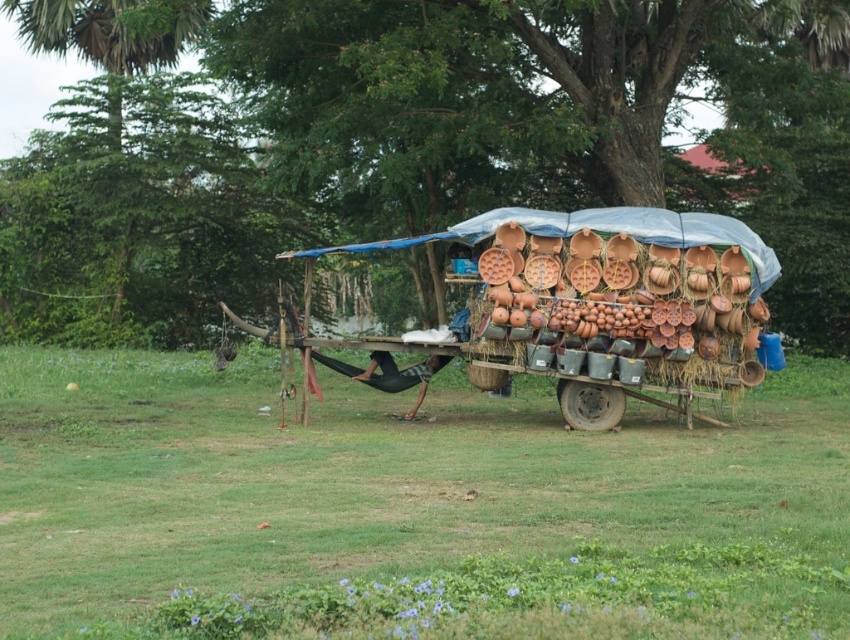
You are standing in the park looking at the cart with pots. There are two points marked on the cart. One is at coordinate point [468,499] and the other is at point [656,237]. Which point is closer to you?

Point [468,499] is closer to the viewer than point [656,237].

You are standing at the edge of the grassy area and want to walk towards the cart. Which direction should you move to first approach the green grass at lower center before reaching the terracotta clay cart at center?

Since the green grass at lower center is in front of the terracotta clay cart at center, you should move forward towards the green grass at lower center first, and then proceed to the cart behind it.

Looking at this image, you are a gardener standing on the green grass at lower center and want to reach the terracotta clay cart at center. Can you step onto the cart from where you are standing?

The green grass at lower center is shorter than the terracotta clay cart at center, so stepping onto the cart might be difficult due to the height difference.